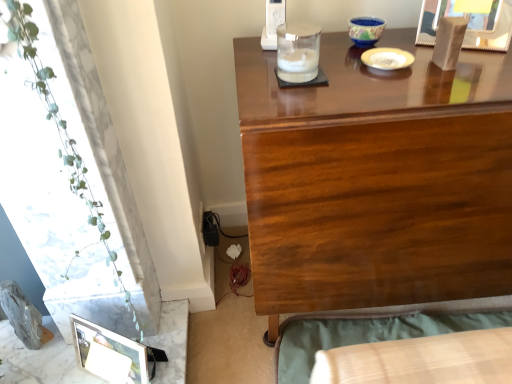
Find the location of a particular element. The image size is (512, 384). empty space that is in between blue ceramic bowl at upper center, the first candle holder in the back-to-front sequence, and wooden picture frame at upper right, the 2th picture frame positioned from the left is located at coordinates (410, 39).